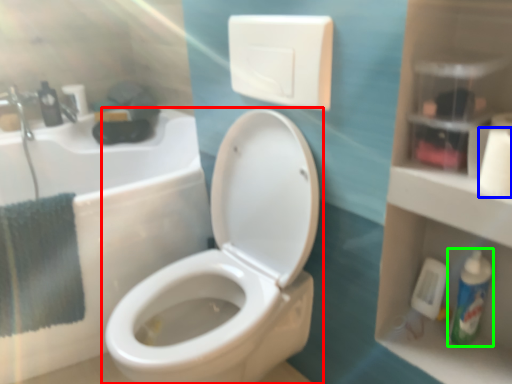
Question: Which object is the closest to the toilet (highlighted by a red box)? Choose among these: toilet paper (highlighted by a blue box) or mouthwash (highlighted by a green box).

Choices:
 (A) toilet paper
 (B) mouthwash

Answer: (B)